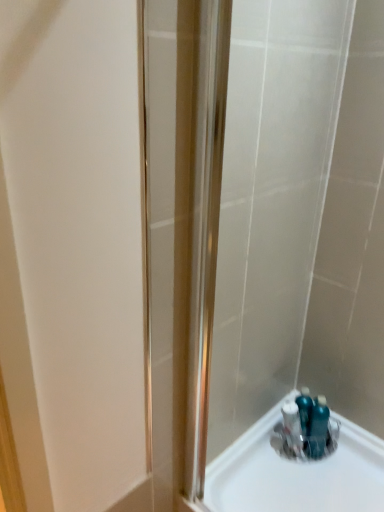
Question: Is satin nickel shower door at center positioned behind blue glossy bottles at bottom right, the 2th sink in the left-to-right sequence?

Choices:
 (A) yes
 (B) no

Answer: (B)

Question: Considering the relative sizes of satin nickel shower door at center and blue glossy bottles at bottom right, which is the first sink from right to left, in the image provided, is satin nickel shower door at center bigger than blue glossy bottles at bottom right, which is the first sink from right to left,?

Choices:
 (A) no
 (B) yes

Answer: (B)

Question: Is satin nickel shower door at center positioned beyond the bounds of blue glossy bottles at bottom right, which is the first sink from right to left?

Choices:
 (A) yes
 (B) no

Answer: (A)

Question: Is satin nickel shower door at center looking in the opposite direction of blue glossy bottles at bottom right, the 2th sink in the left-to-right sequence?

Choices:
 (A) no
 (B) yes

Answer: (B)

Question: Could blue glossy bottles at bottom right, which is the first sink from right to left, be considered to be inside satin nickel shower door at center?

Choices:
 (A) no
 (B) yes

Answer: (A)

Question: In terms of height, does clear plastic container at bottom right, the first sink viewed from the left, look taller or shorter compared to blue glossy bottles at bottom right, which is the first sink from right to left?

Choices:
 (A) short
 (B) tall

Answer: (A)

Question: Looking at the image, does clear plastic container at bottom right, the first sink viewed from the left, seem bigger or smaller compared to blue glossy bottles at bottom right, the 2th sink in the left-to-right sequence?

Choices:
 (A) small
 (B) big

Answer: (B)

Question: Considering the positions of point (271, 410) and point (314, 446), is point (271, 410) closer or farther from the camera than point (314, 446)?

Choices:
 (A) closer
 (B) farther

Answer: (B)

Question: From the image's perspective, relative to blue glossy bottles at bottom right, the 2th sink in the left-to-right sequence, is clear plastic container at bottom right, which ranks as the second sink in right-to-left order, above or below?

Choices:
 (A) above
 (B) below

Answer: (B)

Question: From a real-world perspective, is blue glossy bottles at bottom right, which is the first sink from right to left, physically located above or below clear plastic container at bottom right, which ranks as the second sink in right-to-left order?

Choices:
 (A) below
 (B) above

Answer: (B)

Question: From the image's perspective, is blue glossy bottles at bottom right, the 2th sink in the left-to-right sequence, positioned above or below clear plastic container at bottom right, the first sink viewed from the left?

Choices:
 (A) above
 (B) below

Answer: (A)

Question: Is point (319, 410) closer or farther from the camera than point (243, 479)?

Choices:
 (A) farther
 (B) closer

Answer: (A)

Question: Is blue glossy bottles at bottom right, the 2th sink in the left-to-right sequence, wider or thinner than clear plastic container at bottom right, which ranks as the second sink in right-to-left order?

Choices:
 (A) wide
 (B) thin

Answer: (B)

Question: In terms of height, does satin nickel shower door at center look taller or shorter compared to clear plastic container at bottom right, the first sink viewed from the left?

Choices:
 (A) tall
 (B) short

Answer: (A)

Question: Is satin nickel shower door at center to the left or to the right of clear plastic container at bottom right, the first sink viewed from the left, in the image?

Choices:
 (A) left
 (B) right

Answer: (A)